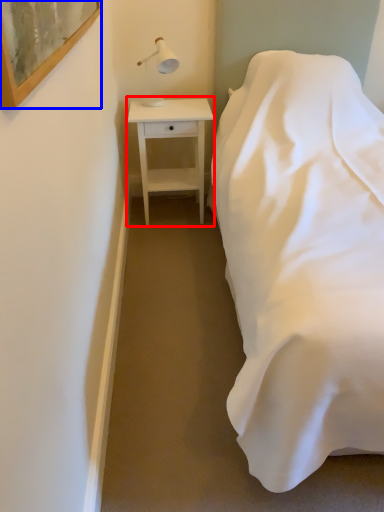
Question: Which object appears farthest to the camera in this image, nightstand (highlighted by a red box) or picture frame (highlighted by a blue box)?

Choices:
 (A) nightstand
 (B) picture frame

Answer: (A)